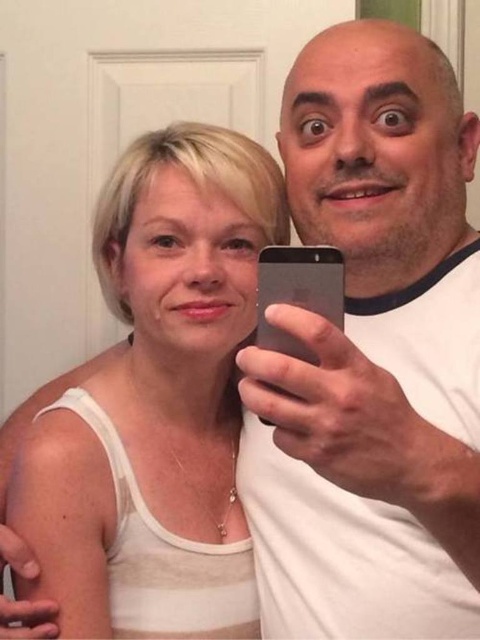
You are standing in the room and want to place a small sticker on the closest point between the two points, point (100, 230) and point (332, 310). Which point should you choose?

Point (100, 230) is closer to the viewer than point (332, 310), so you should place the sticker on point (100, 230).

What is the exact coordinate location of the white matte tank top at center in the image?

The white matte tank top at center is located at point [157,403].

You are standing at point (372,170) in the image and want to take a photo of the two people. The camera you have can focus on subjects within 30 inches. Will the camera be able to capture them clearly?

The distance between point (372,170) and the camera is 29.21 inches, which is within the 30 inches focus range. Therefore, the camera can capture them clearly.